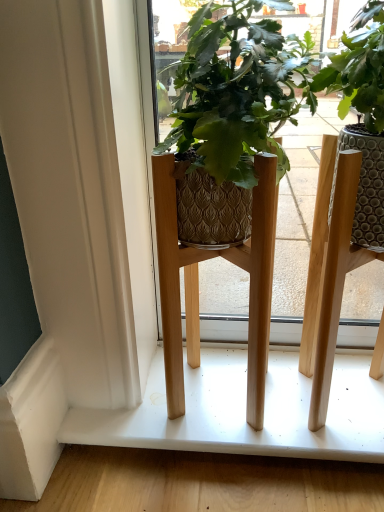
What do you see at coordinates (245, 410) in the screenshot? This screenshot has height=512, width=384. I see `white matte shelf at lower center` at bounding box center [245, 410].

The image size is (384, 512). What are the coordinates of `white matte shelf at lower center` in the screenshot? It's located at (245, 410).

In order to face white matte shelf at lower center, should I rotate leftwards or rightwards?

It's best to rotate right around 6.133 degrees.

I want to click on white matte shelf at lower center, so click(x=245, y=410).